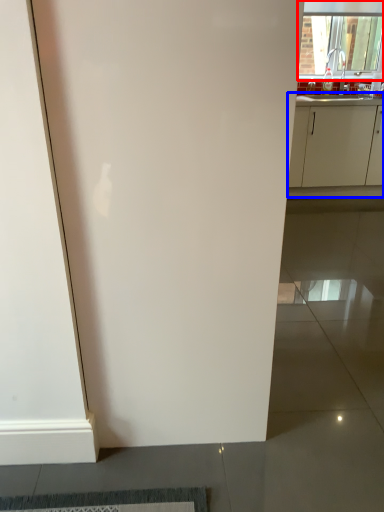
Question: Which object is further to the camera taking this photo, window (highlighted by a red box) or cabinetry (highlighted by a blue box)?

Choices:
 (A) window
 (B) cabinetry

Answer: (A)